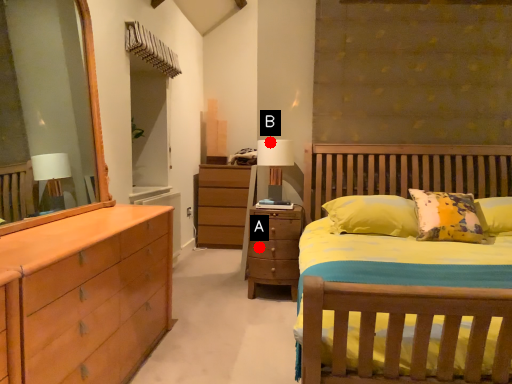
Question: Two points are circled on the image, labeled by A and B beside each circle. Which point is further to the camera?

Choices:
 (A) A is further
 (B) B is further

Answer: (B)